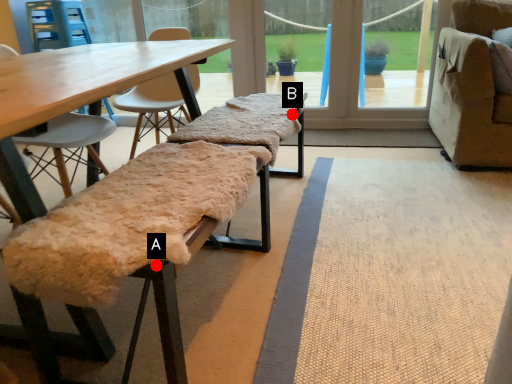
Question: Two points are circled on the image, labeled by A and B beside each circle. Which of the following is the farthest from the observer?

Choices:
 (A) A is further
 (B) B is further

Answer: (B)